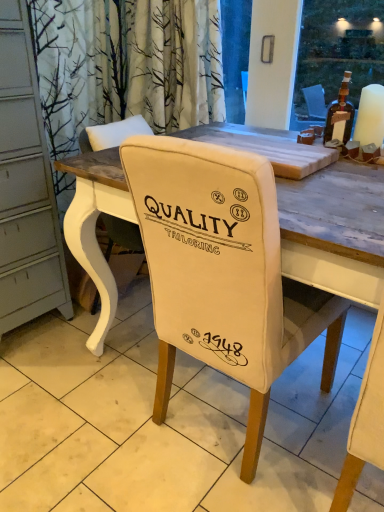
Describe the element at coordinates (223, 272) in the screenshot. The height and width of the screenshot is (512, 384). I see `white fabric chair at center` at that location.

At what (x,y) coordinates should I click in order to perform the action: click on white fabric chair back at center. Please return your answer as a coordinate pair (x, y). The width and height of the screenshot is (384, 512). Looking at the image, I should click on (163, 424).

Which of these two, brown glass bottle at upper right or white matte candle at upper right, is bigger?

brown glass bottle at upper right.

Is brown glass bottle at upper right oriented away from white matte candle at upper right?

No, brown glass bottle at upper right is not facing away from white matte candle at upper right.

Is point (338, 104) closer or farther from the camera than point (361, 105)?

Point (338, 104) appears to be farther away from the viewer than point (361, 105).

Would you say brown glass bottle at upper right is a long distance from white matte candle at upper right?

No, brown glass bottle at upper right is not far away from white matte candle at upper right.

Is white fabric chair at center not near white fabric chair back at center?

No, white fabric chair at center is not far from white fabric chair back at center.

Considering the relative sizes of white fabric chair at center and white fabric chair back at center in the image provided, is white fabric chair at center shorter than white fabric chair back at center?

No.

From the picture: Does white fabric chair at center turn towards white fabric chair back at center?

No, white fabric chair at center is not facing towards white fabric chair back at center.

Locate an element on the screen. tile below the white fabric chair at center (from a real-world perspective) is located at coordinates (163, 424).

Is white fabric chair at center far from white matte candle at upper right?

No, white fabric chair at center is in close proximity to white matte candle at upper right.

Between white fabric chair at center and white matte candle at upper right, which one has larger width?

white fabric chair at center.

From a real-world perspective, who is located lower, white fabric chair at center or white matte candle at upper right?

white fabric chair at center, from a real-world perspective.

Can you confirm if white fabric chair at center is shorter than white matte candle at upper right?

No, white fabric chair at center is not shorter than white matte candle at upper right.

Are white matte candle at upper right and white fabric chair back at center located far from each other?

That's right, there is a large distance between white matte candle at upper right and white fabric chair back at center.

Is white matte candle at upper right inside the boundaries of white fabric chair back at center, or outside?

white matte candle at upper right is located beyond the bounds of white fabric chair back at center.

From a real-world perspective, is white matte candle at upper right below white fabric chair back at center?

No, from a real-world perspective, white matte candle at upper right is not below white fabric chair back at center.

Which is further, (x=359, y=111) or (x=285, y=504)?

The point (x=359, y=111) is farther from the camera.

From a real-world perspective, which object stands above the other?

brown glass bottle at upper right, from a real-world perspective.

Considering the positions of point (342, 134) and point (324, 490), is point (342, 134) closer or farther from the camera than point (324, 490)?

Point (342, 134) appears to be farther away from the viewer than point (324, 490).

Who is bigger, brown glass bottle at upper right or white fabric chair back at center?

white fabric chair back at center is bigger.

The width and height of the screenshot is (384, 512). What are the coordinates of `tile that appears on the left of brown glass bottle at upper right` in the screenshot? It's located at (163, 424).

Is white matte candle at upper right next to white fabric chair at center and touching it?

white matte candle at upper right is not next to white fabric chair at center, and they're not touching.

Is white matte candle at upper right inside or outside of white fabric chair at center?

white matte candle at upper right is not inside white fabric chair at center, it's outside.

Considering the points (382, 130) and (290, 324), which point is in front, point (382, 130) or point (290, 324)?

The point (290, 324) is in front.

How distant is white matte candle at upper right from white fabric chair at center?

white matte candle at upper right is 30.52 inches from white fabric chair at center.

Is white fabric chair at center positioned far away from brown glass bottle at upper right?

No.

From a real-world perspective, between white fabric chair at center and brown glass bottle at upper right, who is vertically higher?

From a 3D spatial view, brown glass bottle at upper right is above.

Could brown glass bottle at upper right be considered to be inside white fabric chair at center?

No, brown glass bottle at upper right is not inside white fabric chair at center.

I want to click on bottle located behind the white matte candle at upper right, so click(340, 114).

The width and height of the screenshot is (384, 512). Identify the location of tile located below the white fabric chair at center (from the image's perspective). (163, 424).

Considering their positions, is white fabric chair at center positioned further to brown glass bottle at upper right than white matte candle at upper right?

white fabric chair at center lies further to brown glass bottle at upper right than the other object.

When comparing their distances from white fabric chair back at center, does brown glass bottle at upper right or white fabric chair at center seem further?

brown glass bottle at upper right is positioned further to the anchor white fabric chair back at center.

From the image, which object appears to be farther from brown glass bottle at upper right, white matte candle at upper right or white fabric chair back at center?

white fabric chair back at center is positioned further to the anchor brown glass bottle at upper right.

When comparing their distances from white fabric chair at center, does white fabric chair back at center or white matte candle at upper right seem closer?

The object closer to white fabric chair at center is white fabric chair back at center.

Which object lies nearer to the anchor point brown glass bottle at upper right, white fabric chair at center or white fabric chair back at center?

white fabric chair at center lies closer to brown glass bottle at upper right than the other object.

Estimate the real-world distances between objects in this image. Which object is further from brown glass bottle at upper right, white fabric chair back at center or white fabric chair at center?

Among the two, white fabric chair back at center is located further to brown glass bottle at upper right.

When comparing their distances from white matte candle at upper right, does white fabric chair at center or brown glass bottle at upper right seem closer?

Among the two, brown glass bottle at upper right is located nearer to white matte candle at upper right.

Which object lies further to the anchor point white fabric chair at center, white matte candle at upper right or brown glass bottle at upper right?

brown glass bottle at upper right.

Where is `chair between brown glass bottle at upper right and white fabric chair back at center in the up-down direction`? This screenshot has height=512, width=384. chair between brown glass bottle at upper right and white fabric chair back at center in the up-down direction is located at coordinates (223, 272).

The image size is (384, 512). Find the location of `candle between brown glass bottle at upper right and white fabric chair back at center in the vertical direction`. candle between brown glass bottle at upper right and white fabric chair back at center in the vertical direction is located at coordinates (370, 116).

Where is `candle between white fabric chair at center and brown glass bottle at upper right from front to back`? This screenshot has height=512, width=384. candle between white fabric chair at center and brown glass bottle at upper right from front to back is located at coordinates (370, 116).

Locate an element on the screen. Image resolution: width=384 pixels, height=512 pixels. chair between white matte candle at upper right and white fabric chair back at center in the vertical direction is located at coordinates (223, 272).